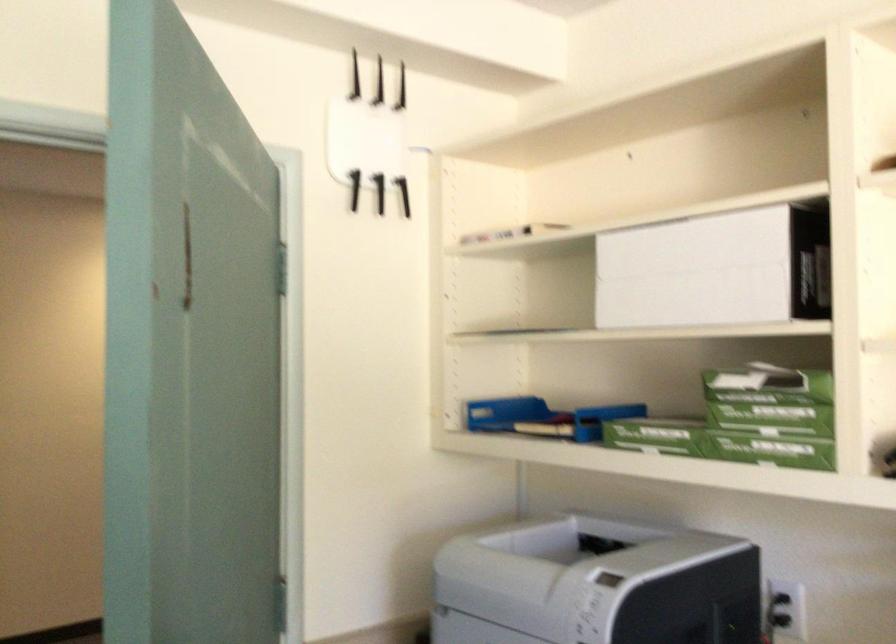
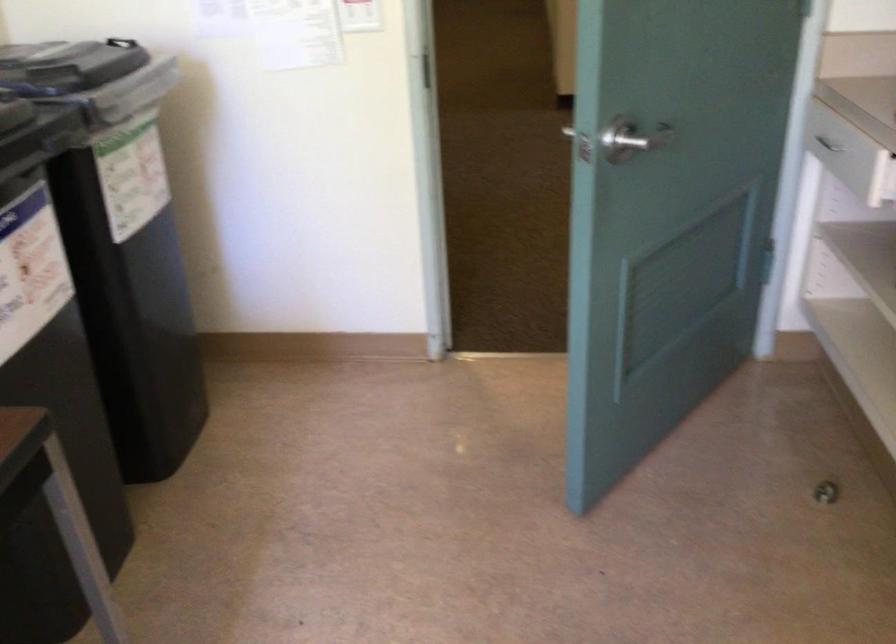
First-person continuous shooting, in which direction is the camera rotating?

The rotation direction of the camera is left-down.